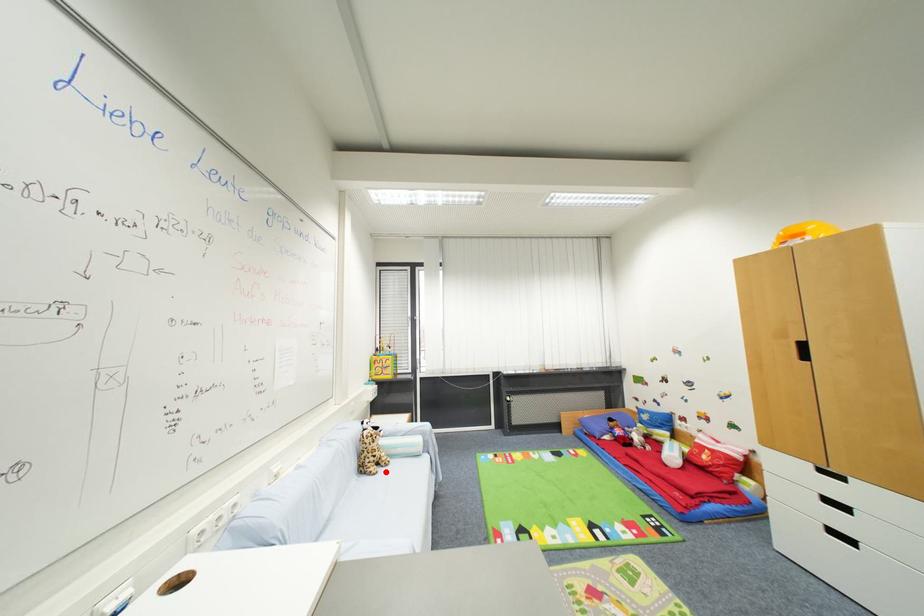
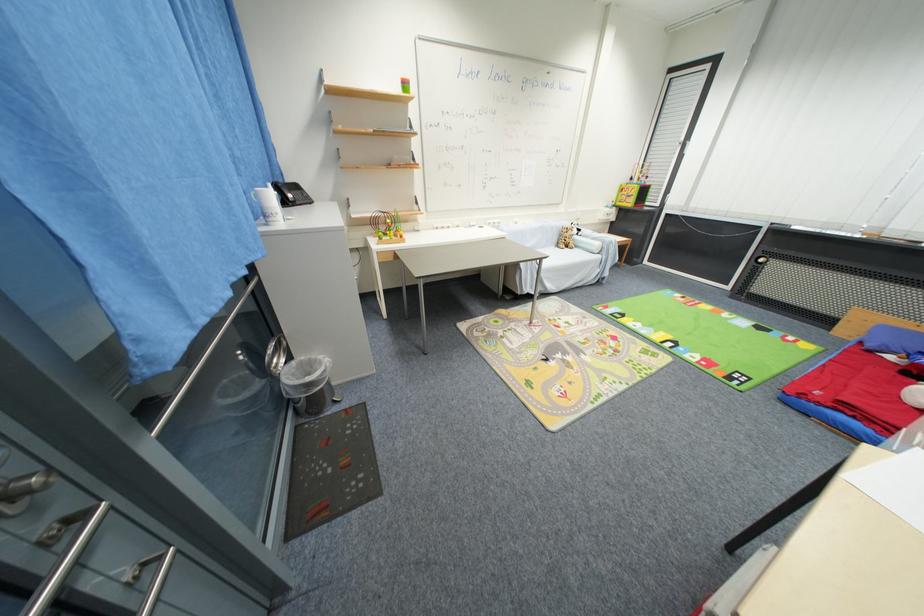
Question: I am providing you with two images of the same scene from different viewpoints. Image1 has a red point marked. In image2, the corresponding 3D location appears at what relative position? Reply with the corresponding letter.

Choices:
 (A) Closer
 (B) Farther

Answer: (B)